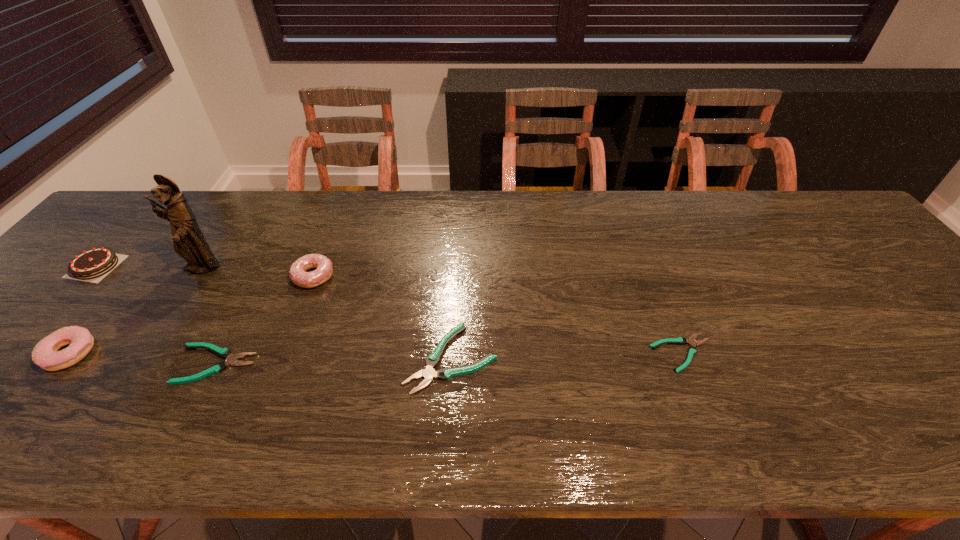
This screenshot has width=960, height=540. I want to click on the farther doughnut, so click(298, 275).

The image size is (960, 540). I want to click on the nearer doughnut, so click(45, 354).

This screenshot has height=540, width=960. In order to click on vacant space located 0.280m on the left of the sixth tallest object in this screenshot , I will do `click(50, 364)`.

I want to click on blank space located 0.100m on the left of the tallest pliers, so click(x=361, y=359).

Where is `vacant space situated on the left of the shortest object`? This screenshot has height=540, width=960. vacant space situated on the left of the shortest object is located at coordinates (481, 353).

The width and height of the screenshot is (960, 540). I want to click on vacant space located 0.140m on the front-facing side of the figurine, so click(x=166, y=325).

At what (x,y) coordinates should I click in order to perform the action: click on free space located on the back of the chocolate cake. Please return your answer as a coordinate pair (x, y). This screenshot has width=960, height=540. Looking at the image, I should click on click(154, 202).

This screenshot has width=960, height=540. In order to click on vacant area situated on the back of the right doughnut in this screenshot , I will do coord(342,202).

You are a GUI agent. You are given a task and a screenshot of the screen. Output one action in this format:
    pyautogui.click(x=<x>, y=<y>)
    Task: Click on the vacant space positioned 0.380m on the back of the nearer doughnut
    
    Given the screenshot: What is the action you would take?
    pyautogui.click(x=166, y=231)

The image size is (960, 540). I want to click on doughnut present at the near edge, so click(x=45, y=354).